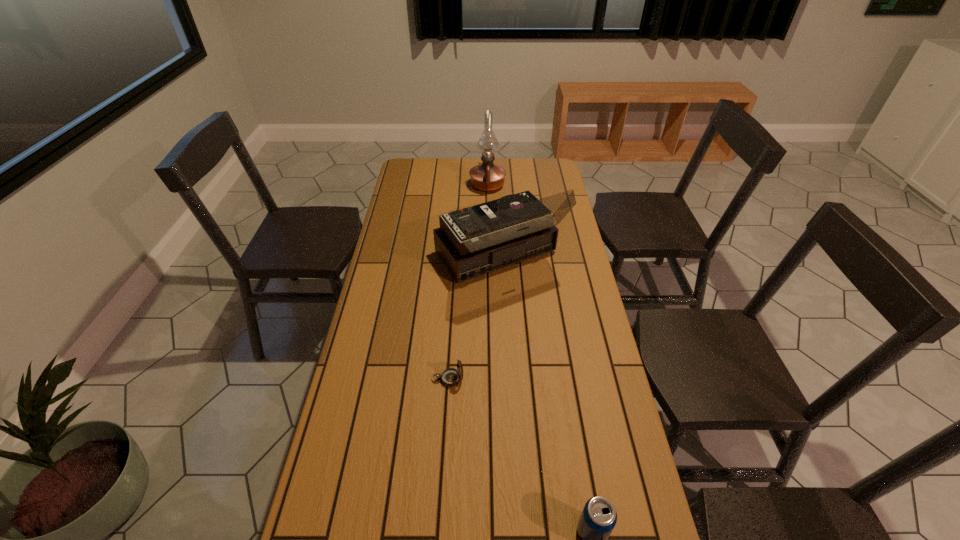
Image resolution: width=960 pixels, height=540 pixels. I want to click on the farthest object, so click(487, 176).

The width and height of the screenshot is (960, 540). In order to click on the third nearest object in this screenshot , I will do `click(473, 241)`.

Where is `the third farthest object`? the third farthest object is located at coordinates (450, 377).

You are a GUI agent. You are given a task and a screenshot of the screen. Output one action in this format:
    pyautogui.click(x=<x>, y=<y>)
    Task: Click on the compass
    This screenshot has width=960, height=540.
    Given the screenshot: What is the action you would take?
    pyautogui.click(x=450, y=377)

The image size is (960, 540). Find the location of `vacant position located on the left of the oil lamp`. vacant position located on the left of the oil lamp is located at coordinates pos(415,185).

Find the location of a particular element. The image size is (960, 540). free region located 0.210m on the left of the record player is located at coordinates (378, 259).

I want to click on vacant space located 0.330m on the face of the third farthest object, so click(x=579, y=379).

Where is `object at the far edge`? object at the far edge is located at coordinates (487, 176).

The width and height of the screenshot is (960, 540). What are the coordinates of `object situated at the right edge` in the screenshot? It's located at (473, 241).

This screenshot has width=960, height=540. In the image, there is a desktop. Find the location of `vacant space at the far edge`. vacant space at the far edge is located at coordinates (437, 183).